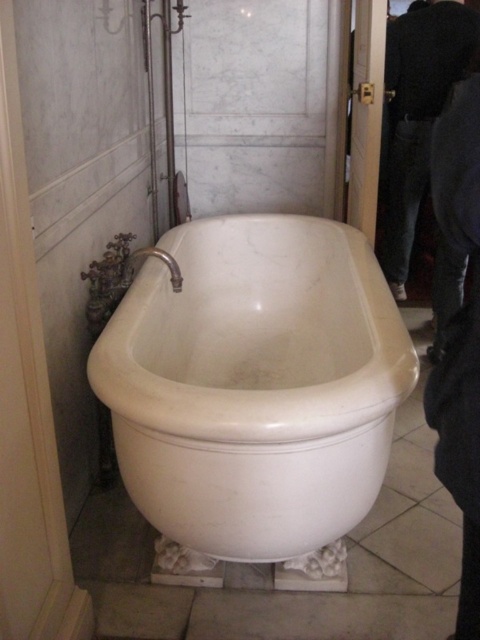
You are standing in the bathroom and need to reach the dark gray jeans at right. However, there is a white marble bathtub at center blocking your path. Can you walk around the bathtub to get to the jeans?

The white marble bathtub at center is in front of the dark gray jeans at right, so you can walk around the bathtub to reach the jeans since they are positioned behind it.